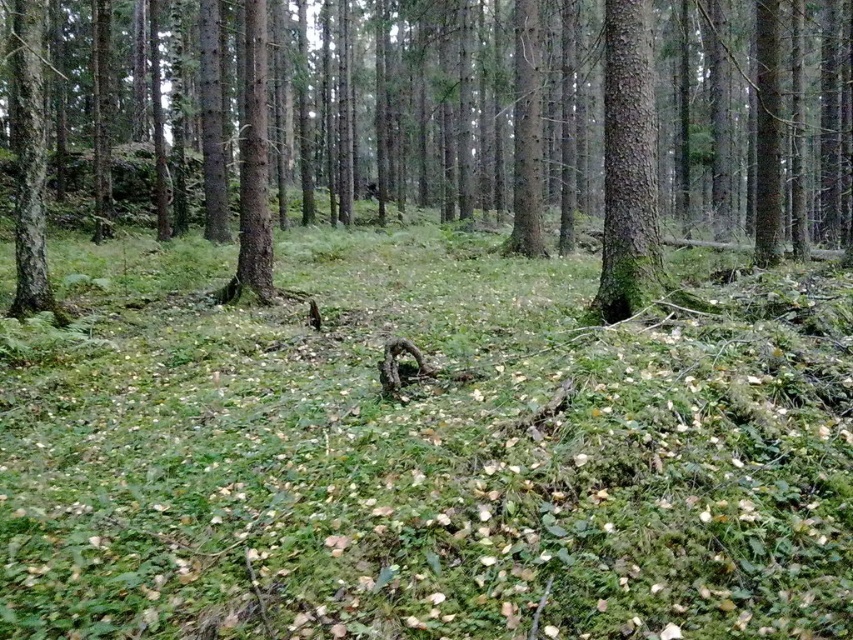
Based on the photo, you are standing in the middle of the forest and see the green mossy tree trunk at center. If you were to draw a straight line from your current position to the tree trunk, what would be the coordinates of the point where this line intersects the edge of the image?

The coordinates of the intersection point cannot be determined without additional information about the image dimensions or the observer position relative to the image plane.

You are a hiker navigating through the forest and want to place a small marker between the green mossy tree trunk at center and the green rough bark tree at center. Can you determine which tree is directly above the other?

The green mossy tree trunk at center is positioned under the green rough bark tree at center, so the green rough bark tree at center is directly above the green mossy tree trunk at center.

You are a hiker trying to cross the forest floor. You need to step over the green leafy grass at center and the green mossy tree trunk at left. Which one will be easier to step over?

The green leafy grass at center is shorter than the green mossy tree trunk at left, so it will be easier to step over the green leafy grass at center.